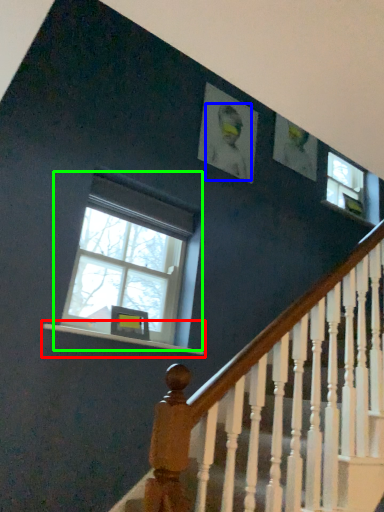
Question: Which is nearer to the window sill (highlighted by a red box)? person (highlighted by a blue box) or window (highlighted by a green box).

Choices:
 (A) person
 (B) window

Answer: (B)